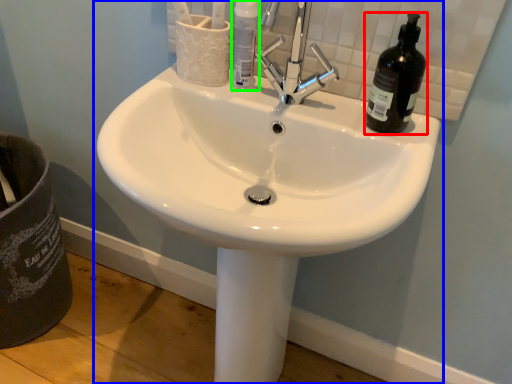
Question: Estimate the real-world distances between objects in this image. Which object is farther from beer bottle (highlighted by a red box), sink (highlighted by a blue box) or bottle (highlighted by a green box)?

Choices:
 (A) sink
 (B) bottle

Answer: (A)